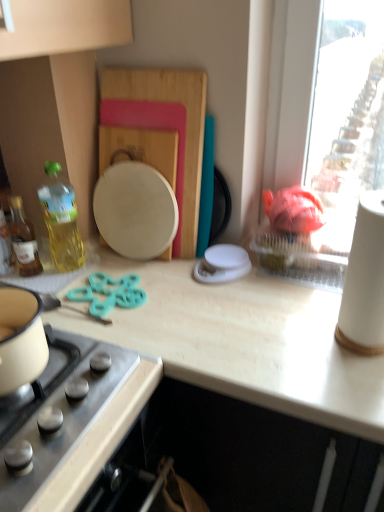
At what (x,y) coordinates should I click in order to perform the action: click on vacant region to the left of white paper towel at right. Please return your answer as a coordinate pair (x, y). This screenshot has width=384, height=512. Looking at the image, I should click on (273, 345).